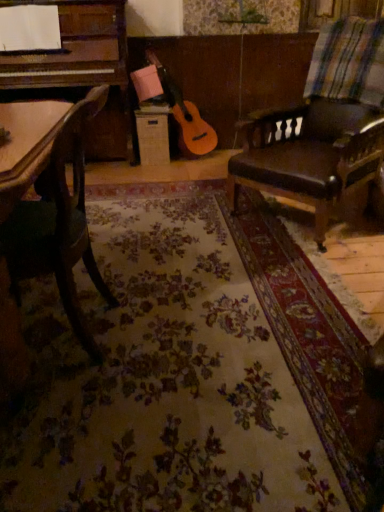
This screenshot has height=512, width=384. What are the coordinates of `free point below leather cushioned chair at right, the second chair positioned from the left (from a real-world perspective)` in the screenshot? It's located at (307, 221).